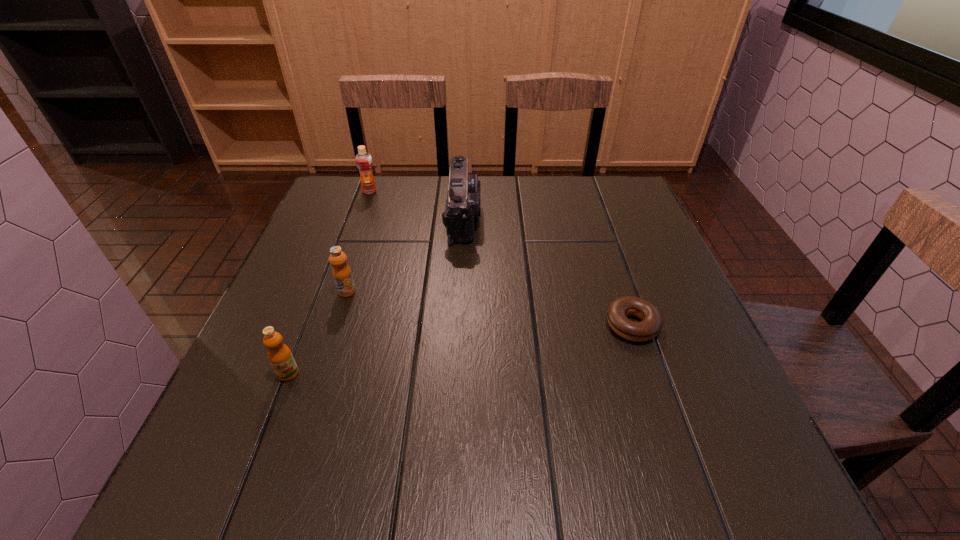
At what (x,y) coordinates should I click in order to perform the action: click on the farthest orange juice. Please return your answer as a coordinate pair (x, y). The image size is (960, 540). Looking at the image, I should click on (363, 159).

At what (x,y) coordinates should I click in order to perform the action: click on the fourth object from left to right. Please return your answer as a coordinate pair (x, y). This screenshot has height=540, width=960. Looking at the image, I should click on (463, 204).

I want to click on the third farthest object, so click(x=341, y=271).

Locate an element on the screen. the nearest object is located at coordinates (280, 356).

In order to click on the rightmost object in this screenshot , I will do `click(618, 310)`.

The width and height of the screenshot is (960, 540). I want to click on the shortest object, so click(x=618, y=310).

You are a GUI agent. You are given a task and a screenshot of the screen. Output one action in this format:
    pyautogui.click(x=<x>, y=<y>)
    Task: Click on the free space located on the right of the farthest orange juice
    The image size is (960, 540).
    Given the screenshot: What is the action you would take?
    pyautogui.click(x=483, y=191)

This screenshot has height=540, width=960. In order to click on free space located 0.160m on the front-facing side of the camcorder in this screenshot , I will do `click(540, 217)`.

The height and width of the screenshot is (540, 960). What are the coordinates of `vacant space located on the front label of the second nearest orange juice` in the screenshot? It's located at (288, 476).

At what (x,y) coordinates should I click in order to perform the action: click on free point located on the front label of the nearest orange juice. Please return your answer as a coordinate pair (x, y). Image resolution: width=960 pixels, height=540 pixels. Looking at the image, I should click on (265, 433).